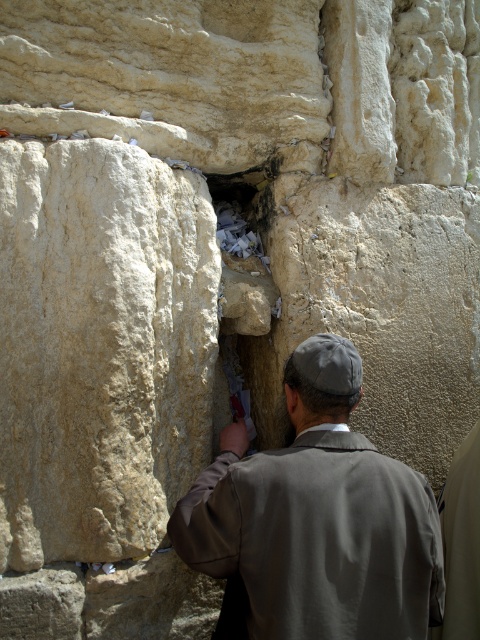
You are a tourist visiting the Western Wall and notice the gray fabric jacket at center and the white paper at center. Which object is physically nearer to you?

The gray fabric jacket at center is closer to the viewer than the white paper at center.

You are a tourist visiting the Western Wall and notice a gray fabric jacket at center and white paper at center. Which object is located to the right of the other?

The gray fabric jacket at center is positioned on the right side of white paper at center.

You are a visitor at the Western Wall and want to place a new prayer note. The gray fabric jacket at center is blocking the narrow opening where the white paper at center is. Can you estimate if the jacket is wider than the opening?

The gray fabric jacket at center might be wider than white paper at center, so there is a possibility that the jacket is wider than the opening. You may need to move the jacket to place your note.